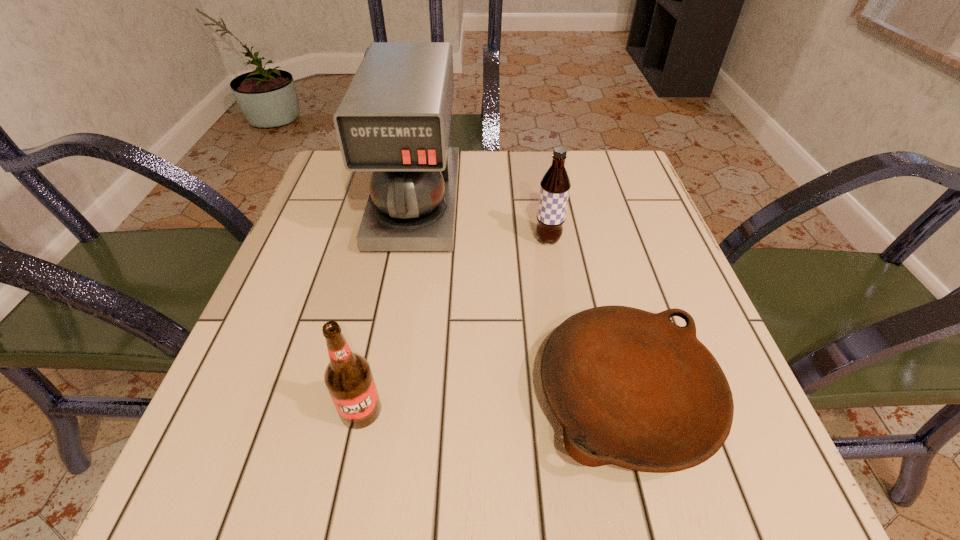
At what (x,y) coordinates should I click in order to perform the action: click on vacant area at the far right corner. Please return your answer as a coordinate pair (x, y). The height and width of the screenshot is (540, 960). Looking at the image, I should click on (589, 178).

The image size is (960, 540). Find the location of `free space between the farther root beer and the coffee maker`. free space between the farther root beer and the coffee maker is located at coordinates (482, 221).

The image size is (960, 540). I want to click on free space between the nearer root beer and the farther root beer, so [x=454, y=325].

This screenshot has height=540, width=960. I want to click on empty location between the plate and the nearer root beer, so click(x=493, y=403).

Find the location of a particular element. free space between the plate and the left root beer is located at coordinates (493, 403).

This screenshot has width=960, height=540. What are the coordinates of `free point between the shortest object and the coffee maker` in the screenshot? It's located at (521, 300).

You are a GUI agent. You are given a task and a screenshot of the screen. Output one action in this format:
    pyautogui.click(x=<x>, y=<y>)
    Task: Click on the object that can be found as the closest to the plate
    Image resolution: width=960 pixels, height=540 pixels.
    Given the screenshot: What is the action you would take?
    pyautogui.click(x=555, y=185)

Locate which object is the second closest to the plate. Please provide its 2D coordinates. Your answer should be formatted as a tuple, i.e. [(x, y)], where the tuple contains the x and y coordinates of a point satisfying the conditions above.

[(394, 119)]

This screenshot has height=540, width=960. What are the coordinates of `free location that satisfies the following two spatial constraints: 1. on the carafe side of the right root beer; 2. on the left side of the tallest object` in the screenshot? It's located at (410, 239).

The image size is (960, 540). Identify the location of free space that satisfies the following two spatial constraints: 1. on the carafe side of the plate; 2. on the right side of the coffee maker. (383, 396).